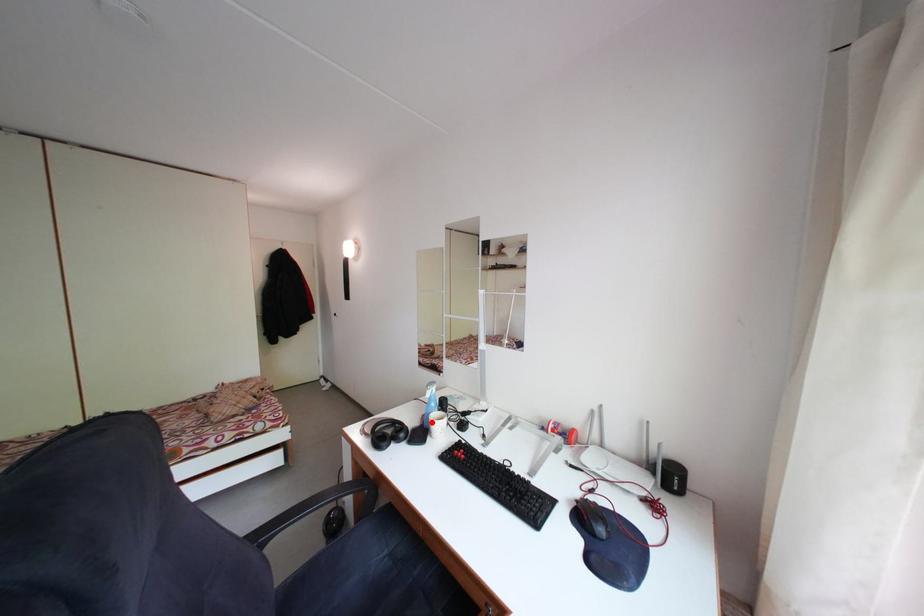
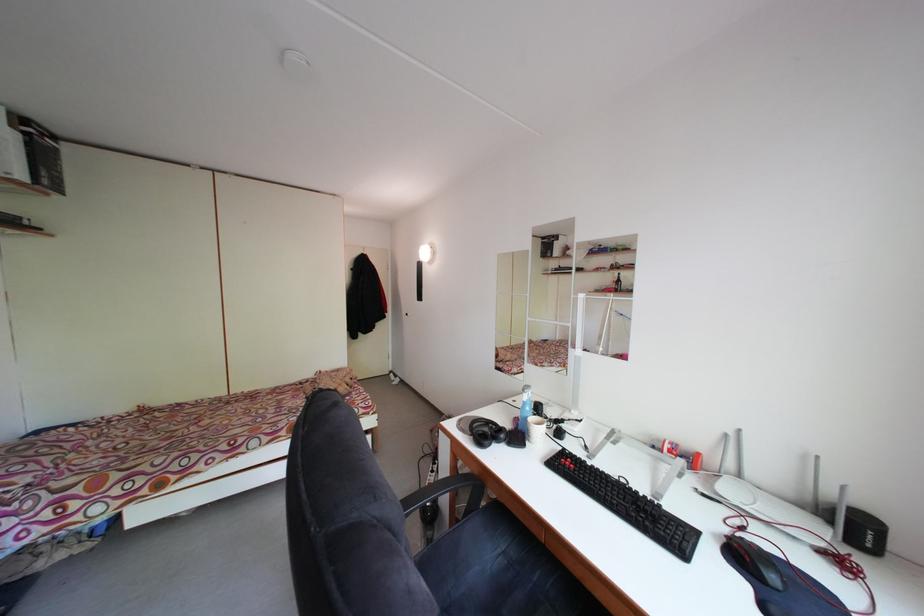
The point at the highlighted location is marked in the first image. Where is the corresponding point in the second image?

(524, 426)